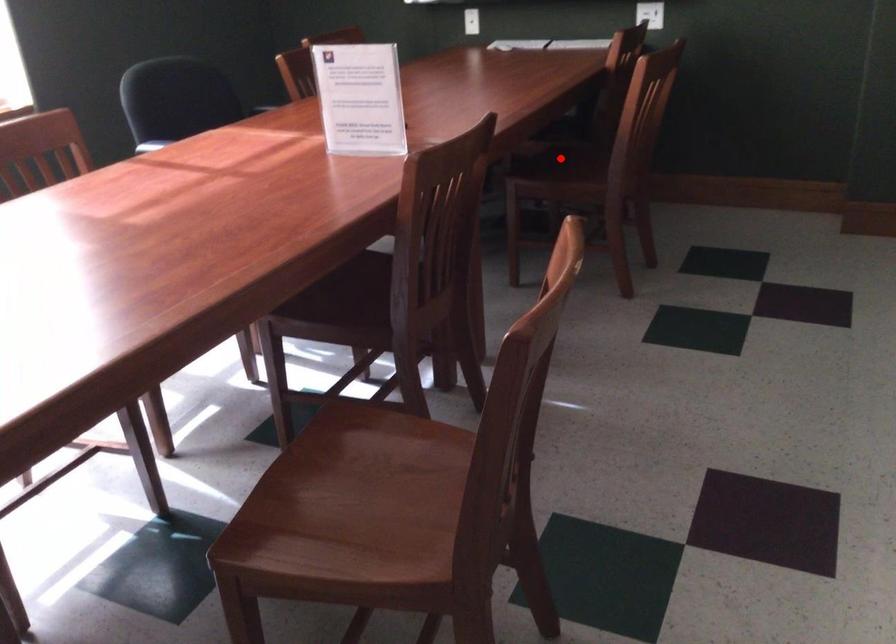
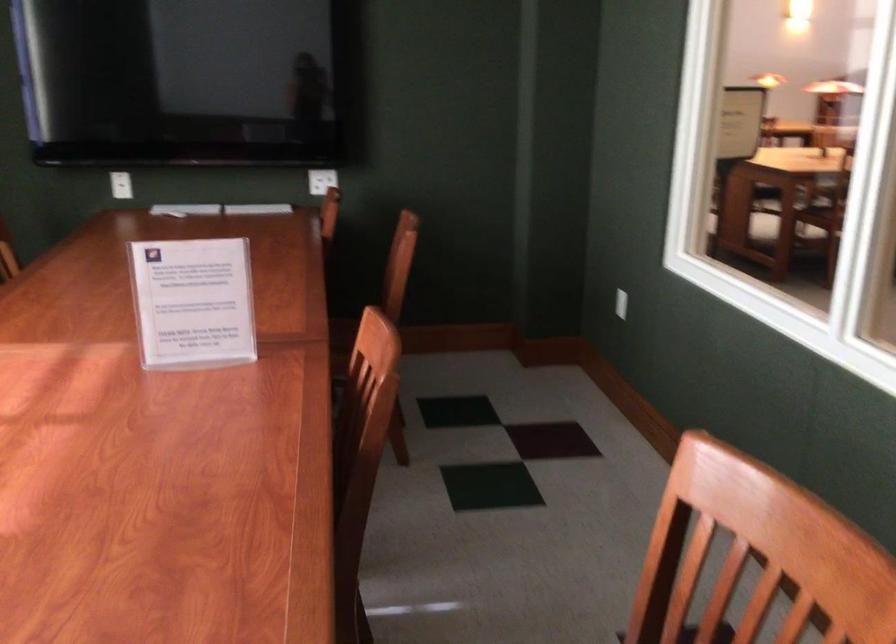
Question: I am providing you with two images of the same scene from different viewpoints. A red point is marked on the first image. At the location where the point appears in image 1, is it still visible in image 2?

Choices:
 (A) Yes
 (B) No

Answer: (B)